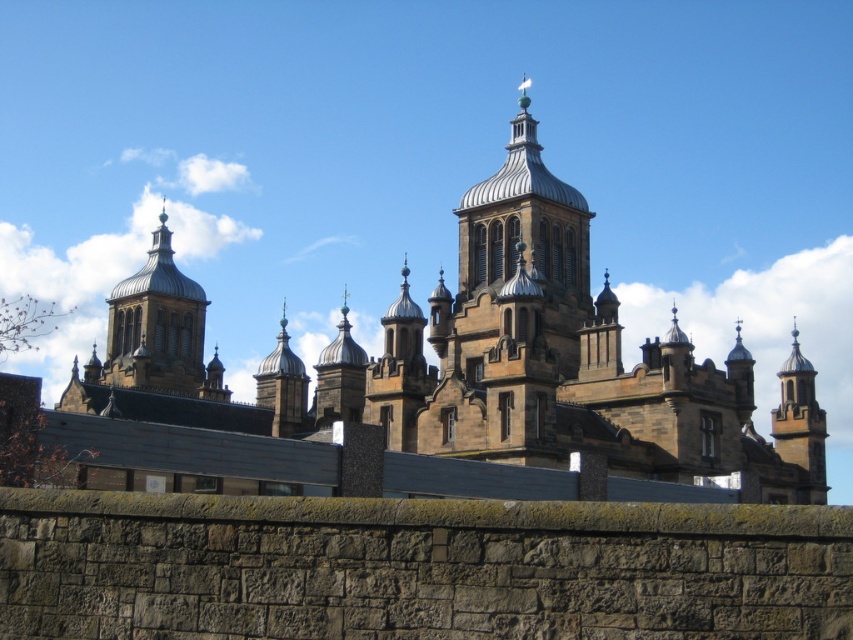
Question: Is brown stone church at center behind matte gold dome at center?

Choices:
 (A) no
 (B) yes

Answer: (A)

Question: Which object appears farthest from the camera in this image?

Choices:
 (A) smooth stone tower at right
 (B) matte gold dome at center

Answer: (B)

Question: Which object is positioned farthest from the matte gold dome at center?

Choices:
 (A) brown stone church at center
 (B) smooth stone tower at right

Answer: (B)

Question: Which object is positioned farthest from the smooth stone tower at right?

Choices:
 (A) brown stone church at center
 (B) matte gold dome at center

Answer: (B)

Question: Is the position of brown stone church at center less distant than that of matte gold dome at center?

Choices:
 (A) yes
 (B) no

Answer: (A)

Question: Is matte gold dome at center further to camera compared to smooth stone tower at right?

Choices:
 (A) yes
 (B) no

Answer: (A)